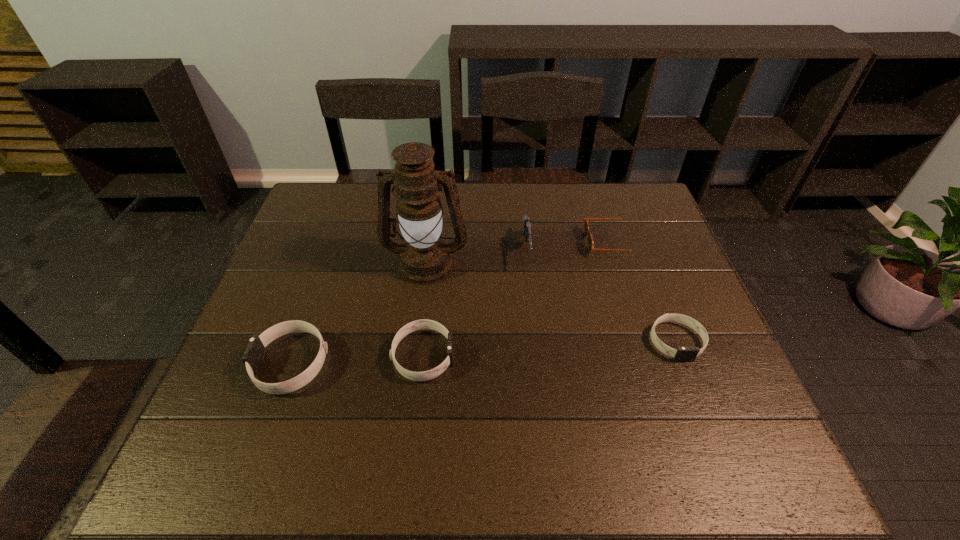
Identify the location of vacant area in the image that satisfies the following two spatial constraints: 1. on the outer surface of the rightmost wristband; 2. on the outer surface of the leftmost wristband. Image resolution: width=960 pixels, height=540 pixels. (684, 363).

You are a GUI agent. You are given a task and a screenshot of the screen. Output one action in this format:
    pyautogui.click(x=<x>, y=<y>)
    Task: Click on the free space that satisfies the following two spatial constraints: 1. on the front-facing side of the sunglasses; 2. at the barrel of the fifth shortest object
    The width and height of the screenshot is (960, 540).
    Given the screenshot: What is the action you would take?
    pyautogui.click(x=613, y=251)

Find the location of a particular element. The width and height of the screenshot is (960, 540). vacant region that satisfies the following two spatial constraints: 1. on the outer surface of the rightmost wristband; 2. on the outer surface of the leftmost object is located at coordinates click(684, 363).

Locate an element on the screen. free space that satisfies the following two spatial constraints: 1. on the front-facing side of the sunglasses; 2. at the barrel of the fourth object from left to right is located at coordinates (613, 251).

Find the location of a particular element. The image size is (960, 540). blank space that satisfies the following two spatial constraints: 1. on the outer surface of the rightmost wristband; 2. on the outer surface of the leftmost wristband is located at coordinates (684, 363).

At what (x,y) coordinates should I click in order to perform the action: click on free spot that satisfies the following two spatial constraints: 1. at the barrel of the second tallest object; 2. on the outer surface of the second shortest wristband. Please return your answer as a coordinate pair (x, y). The height and width of the screenshot is (540, 960). Looking at the image, I should click on (538, 356).